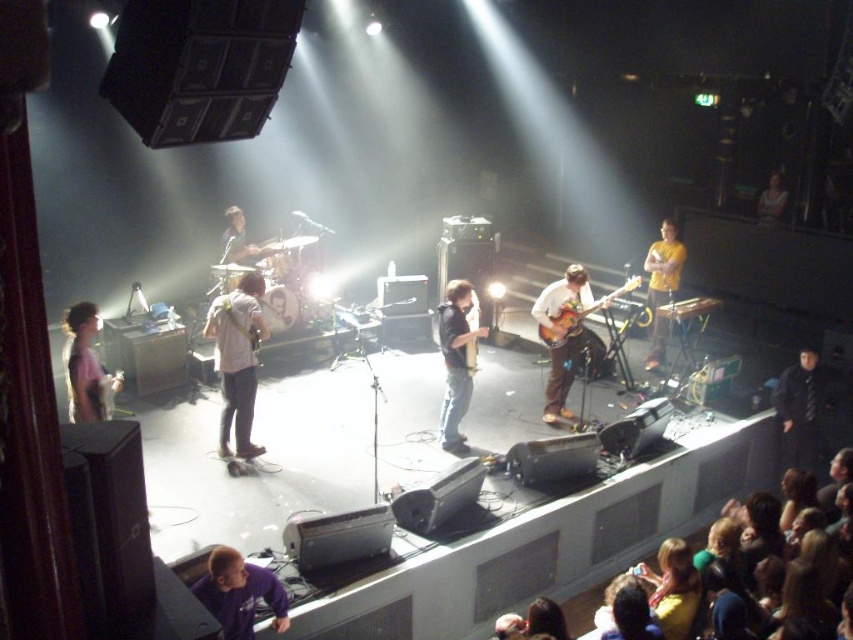
You are a photographer standing at the back of the venue. You want to take a photo that includes both the purple fleece at lower left and the yellow matte shirt at center. The camera you are using has a maximum zoom range that can capture objects up to 5 meters apart. Can you capture both subjects in the same frame without moving closer?

The distance between the purple fleece at lower left and the yellow matte shirt at center is 5.56 meters. Since the camera can only capture up to 5 meters apart, you cannot capture both subjects in the same frame without moving closer.